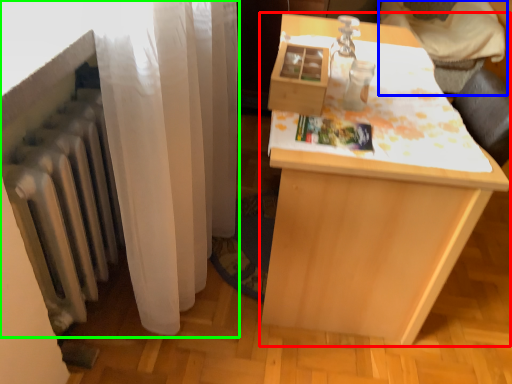
Question: Which object is positioned closest to table (highlighted by a red box)? Select from furniture (highlighted by a blue box) and curtain (highlighted by a green box).

Choices:
 (A) furniture
 (B) curtain

Answer: (B)